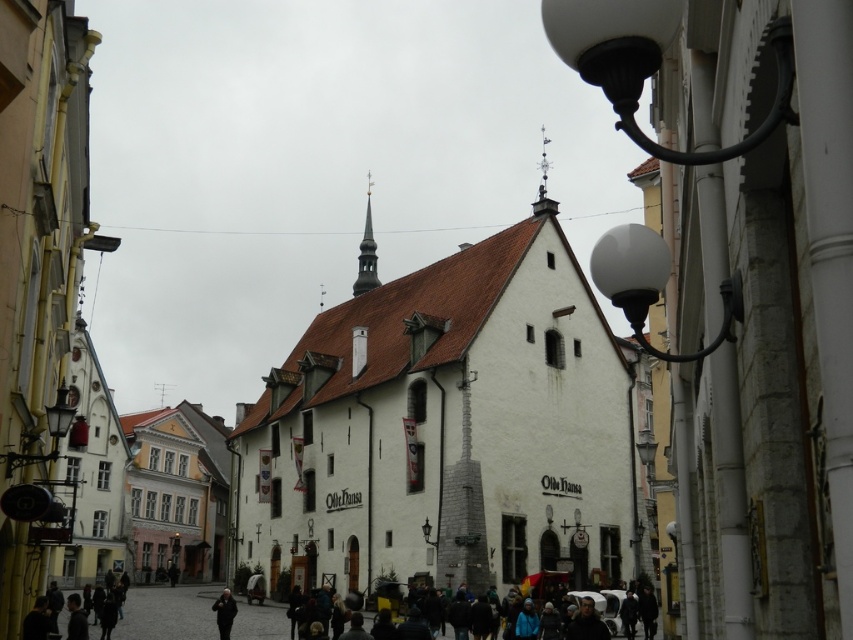
Looking at this image, is polished copper spire at center thinner than polished silver spire at center?

Incorrect, polished copper spire at center's width is not less than polished silver spire at center's.

Can you confirm if polished copper spire at center is bigger than polished silver spire at center?

Correct, polished copper spire at center is larger in size than polished silver spire at center.

Which is behind, point (370, 182) or point (543, 176)?

The point (370, 182) is more distant.

At what (x,y) coordinates should I click in order to perform the action: click on polished copper spire at center. Please return your answer as a coordinate pair (x, y). The height and width of the screenshot is (640, 853). Looking at the image, I should click on (366, 252).

Does point (546, 136) come in front of point (223, 611)?

That is False.

Who is shorter, polished silver spire at center or black matte jacket at lower center?

Standing shorter between the two is polished silver spire at center.

I want to click on polished silver spire at center, so pyautogui.click(x=543, y=182).

You are a GUI agent. You are given a task and a screenshot of the screen. Output one action in this format:
    pyautogui.click(x=<x>, y=<y>)
    Task: Click on the polished silver spire at center
    
    Given the screenshot: What is the action you would take?
    pyautogui.click(x=543, y=182)

Is point (376, 273) positioned before point (225, 609)?

That is False.

Can you confirm if polished copper spire at center is positioned above black matte jacket at lower center?

Yes, polished copper spire at center is above black matte jacket at lower center.

Where is `polished copper spire at center`? The image size is (853, 640). polished copper spire at center is located at coordinates (366, 252).

Identify the location of polished copper spire at center. (366, 252).